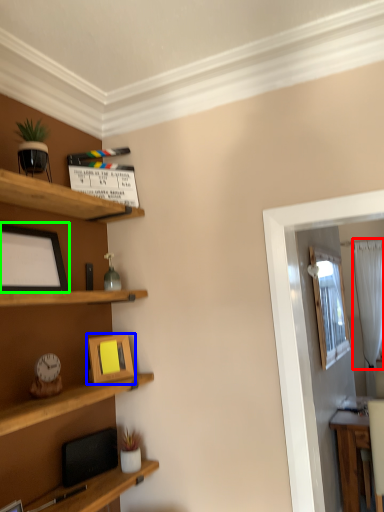
Question: Which object is the farthest from curtain (highlighted by a red box)? Choose among these: picture frame (highlighted by a blue box) or picture frame (highlighted by a green box).

Choices:
 (A) picture frame
 (B) picture frame

Answer: (B)